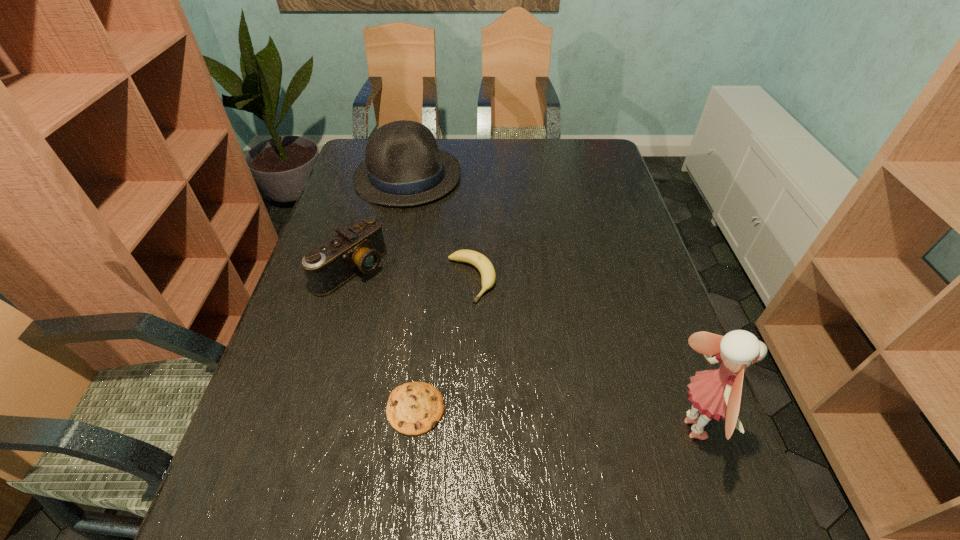
At what (x,y) coordinates should I click in order to perform the action: click on object that can be found as the fourth closest to the cookie. Please return your answer as a coordinate pair (x, y). The width and height of the screenshot is (960, 540). Looking at the image, I should click on (403, 167).

Locate which object is the third closest to the cookie. Please provide its 2D coordinates. Your answer should be formatted as a tuple, i.e. [(x, y)], where the tuple contains the x and y coordinates of a point satisfying the conditions above.

[(716, 393)]

Identify the location of vacant point that satisfies the following two spatial constraints: 1. on the front side of the fourth shortest object; 2. on the right side of the cookie. (361, 409).

Locate an element on the screen. The height and width of the screenshot is (540, 960). free space that satisfies the following two spatial constraints: 1. on the front side of the second shortest object; 2. on the front-facing side of the tallest object is located at coordinates (468, 429).

The width and height of the screenshot is (960, 540). What are the coordinates of `blank space that satisfies the following two spatial constraints: 1. on the front side of the shortest object; 2. on the front-facing side of the rightmost object` in the screenshot? It's located at (414, 429).

The height and width of the screenshot is (540, 960). Find the location of `free space that satisfies the following two spatial constraints: 1. on the front side of the camera; 2. on the front-facing side of the rightmost object`. free space that satisfies the following two spatial constraints: 1. on the front side of the camera; 2. on the front-facing side of the rightmost object is located at coordinates [305, 429].